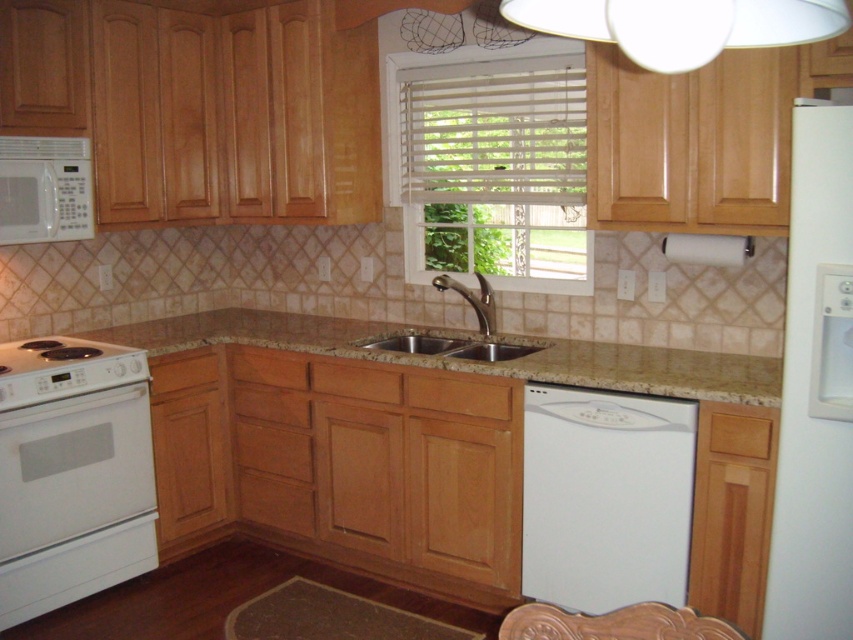
You are a chef preparing a dish and need to place a cutting board on the beige granite countertop at center. However, there is a white matte lampshade at upper center above it. Will the lampshade interfere with placing the cutting board?

The beige granite countertop at center is positioned under the white matte lampshade at upper center, so the lampshade is above the countertop and will not interfere with placing the cutting board.

You are a kitchen designer planning to place a new appliance on the beige granite countertop at center and hang a decorative item from the white matte lampshade at upper center. Considering their widths, which object can accommodate a larger item?

The beige granite countertop at center has a greater width than the white matte lampshade at upper center, so it can accommodate a larger item.

You are a chef preparing a dish and need to place a cutting board on the beige granite countertop at center. However, there is a white matte lampshade at upper center nearby. Which object is positioned to the left of the other?

The beige granite countertop at center is to the left of the white matte lampshade at upper center, so the countertop is positioned to the left of the lampshade.